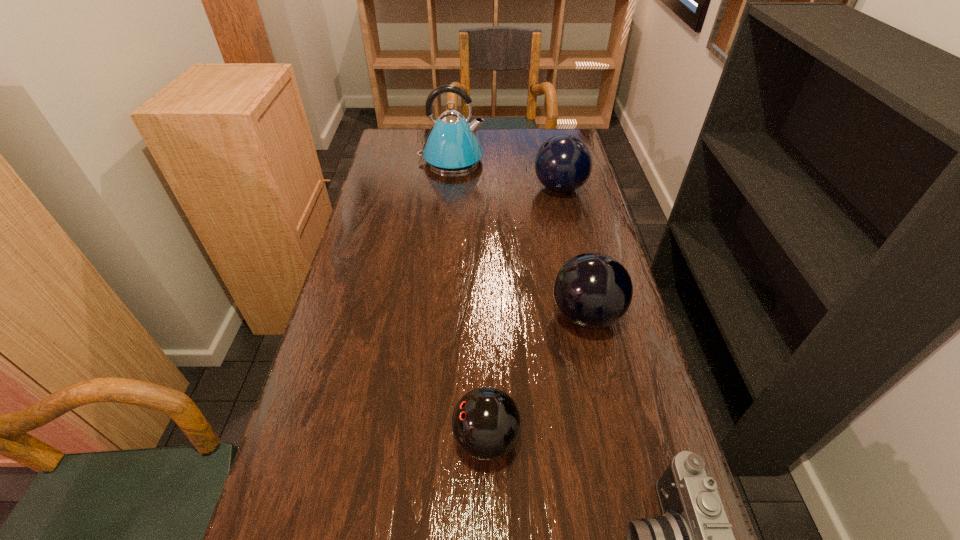
At what (x,y) coordinates should I click in order to perform the action: click on kettle. Please return your answer as a coordinate pair (x, y). This screenshot has height=540, width=960. Looking at the image, I should click on click(452, 146).

This screenshot has width=960, height=540. Identify the location of the farthest bowling ball. (563, 163).

Locate an element on the screen. The height and width of the screenshot is (540, 960). the second nearest bowling ball is located at coordinates (592, 290).

Find the location of a particular element. The width and height of the screenshot is (960, 540). the second nearest object is located at coordinates (486, 423).

Identify the location of the nearest bowling ball. The height and width of the screenshot is (540, 960). (486, 423).

Where is `blank space located 0.080m at the spout of the tallest object`? blank space located 0.080m at the spout of the tallest object is located at coordinates (505, 160).

Locate an element on the screen. The height and width of the screenshot is (540, 960). vacant space located on the surface of the farthest bowling ball near the finger holes is located at coordinates (434, 188).

Where is `free location located on the surface of the farthest bowling ball near the finger holes`? The height and width of the screenshot is (540, 960). free location located on the surface of the farthest bowling ball near the finger holes is located at coordinates (466, 188).

This screenshot has height=540, width=960. Find the location of `free spot located on the surface of the farthest bowling ball near the finger holes`. free spot located on the surface of the farthest bowling ball near the finger holes is located at coordinates (463, 188).

Locate an element on the screen. The width and height of the screenshot is (960, 540). vacant area situated on the side of the third nearest object with the finger holes is located at coordinates [x=530, y=315].